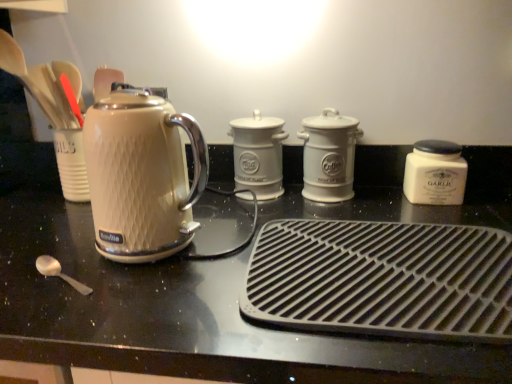
This screenshot has width=512, height=384. Identify the location of vacant area that lies between white ceramic jar at right, which is counted as the third kitchen appliance, starting from the back, and black rubber mat at center, placed as the fourth kitchen appliance when sorted from back to front. (398, 208).